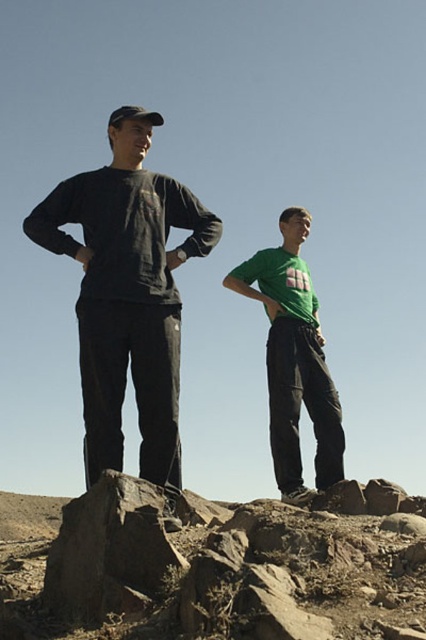
You are a hiker trying to navigate between two points marked on a map. The first point is labeled as point (20, 499) and the second is point (112, 360). According to the scene, which point is further away from your current position?

Point (20, 499) is behind point (112, 360), so it is further away from your current position.

You are a photographer trying to capture the perfect shot of the two people in the scene. You notice a specific point marked at coordinates (127, 292). What object is located at this point?

The point at coordinates (127, 292) corresponds to the matte black sweatshirt at center.